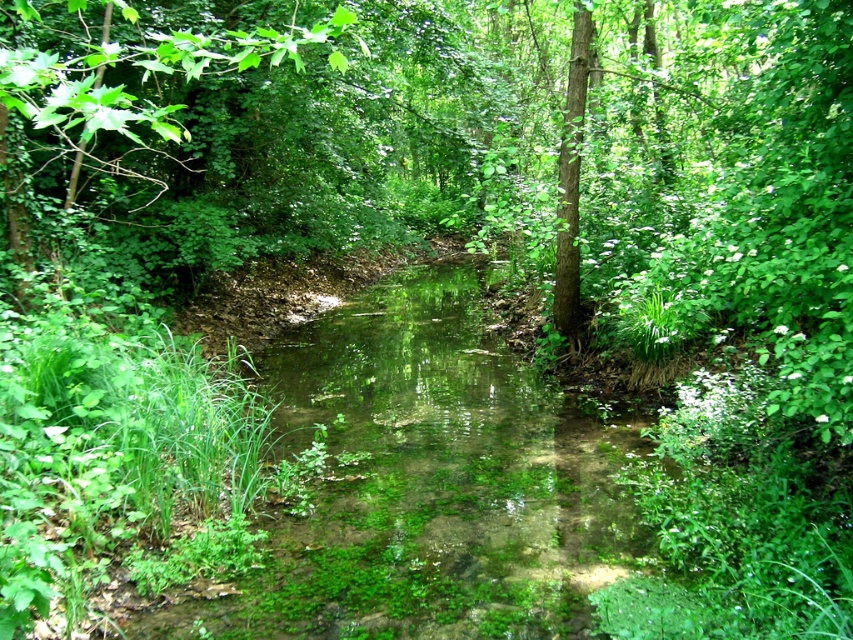
You are standing in the forest and want to find the tallest tree between the green leafy tree at upper left and the green rough bark tree at center. Which tree should you look up to?

The green rough bark tree at center is taller than the green leafy tree at upper left, so you should look up at the green rough bark tree at center.

You are standing at the edge of the green mossy stream at center and want to reach the green leafy tree at upper left. Which direction should you move to get closer to the tree?

The green mossy stream at center has a lesser height compared to the green leafy tree at upper left, so you should move towards the upper left direction to get closer to the green leafy tree at upper left.